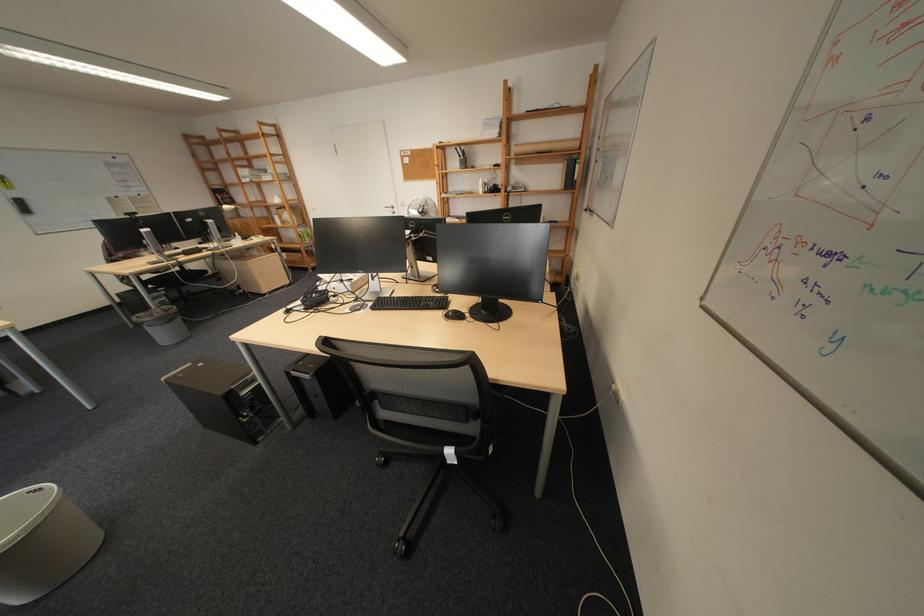
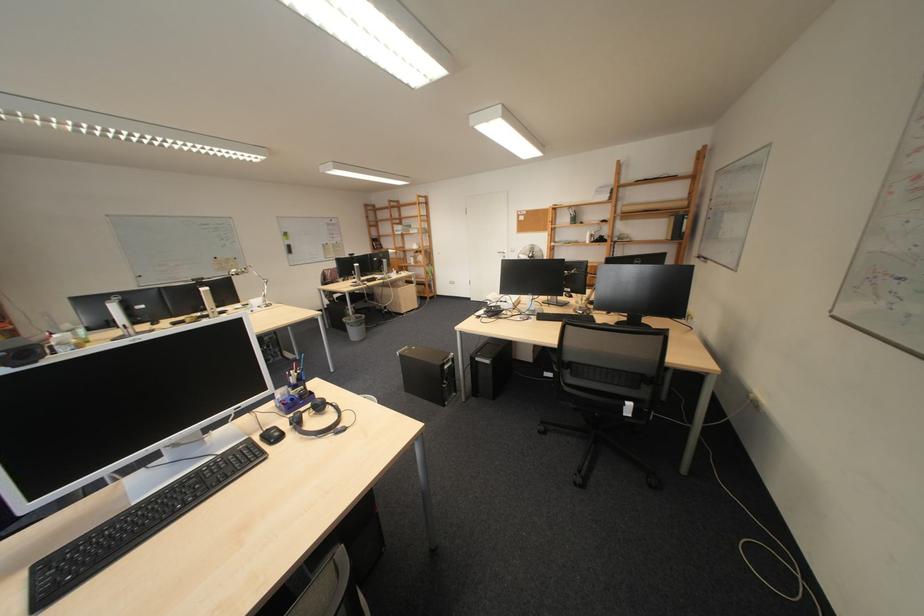
The images are taken continuously from a first-person perspective. In which direction are you moving?

The cameraman moved toward left, backward.